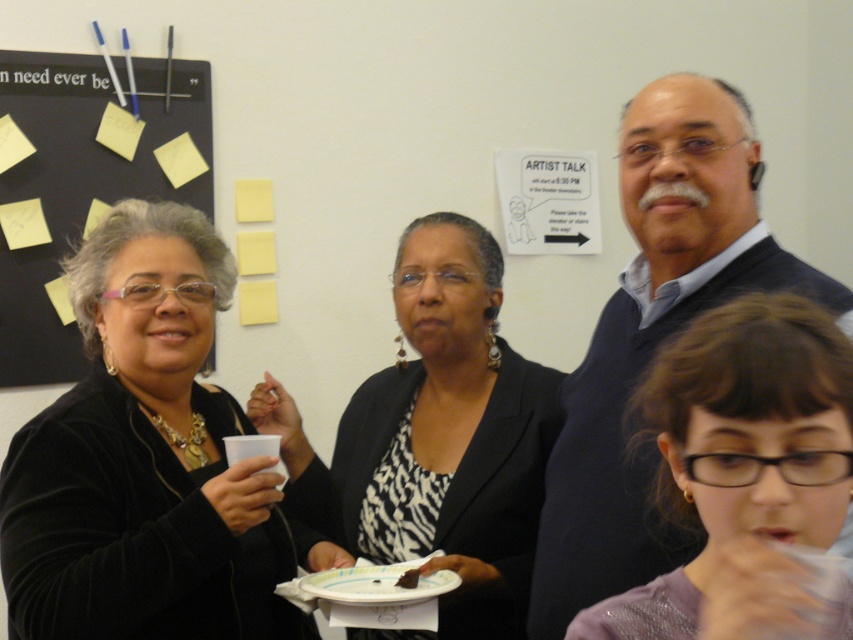
Is white paper plate at lower center to the right of chocolate cake at center from the viewer's perspective?

In fact, white paper plate at lower center is to the left of chocolate cake at center.

Based on the photo, is white paper plate at lower center below chocolate cake at center?

Yes, white paper plate at lower center is below chocolate cake at center.

Describe the element at coordinates (376, 582) in the screenshot. This screenshot has height=640, width=853. I see `white paper plate at lower center` at that location.

I want to click on white paper plate at lower center, so click(x=376, y=582).

Can you confirm if black velvet sweater at left is wider than black matte board at upper left?

Indeed, black velvet sweater at left has a greater width compared to black matte board at upper left.

Is black velvet sweater at left bigger than black matte board at upper left?

Indeed, black velvet sweater at left has a larger size compared to black matte board at upper left.

Is point (196, 627) behind point (90, 188)?

That is False.

This screenshot has width=853, height=640. I want to click on black velvet sweater at left, so click(148, 460).

Which is more to the left, dark blue sweater at upper right or chocolate cake at center?

chocolate cake at center

In the scene shown: Does dark blue sweater at upper right appear on the right side of chocolate cake at center?

Indeed, dark blue sweater at upper right is positioned on the right side of chocolate cake at center.

Which is behind, point (634, 220) or point (413, 586)?

The point (413, 586) is more distant.

You are a GUI agent. You are given a task and a screenshot of the screen. Output one action in this format:
    pyautogui.click(x=<x>, y=<y>)
    Task: Click on the dark blue sweater at upper right
    The width and height of the screenshot is (853, 640).
    Given the screenshot: What is the action you would take?
    pyautogui.click(x=654, y=336)